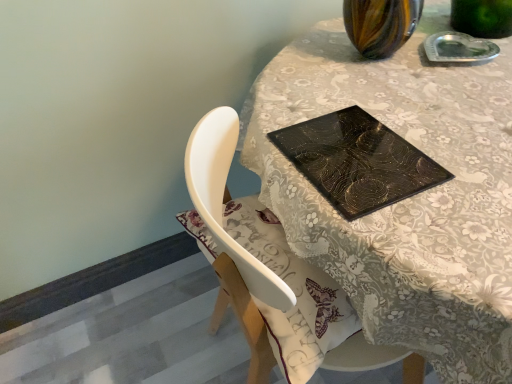
Find the location of a particular element. Image resolution: width=512 pixels, height=384 pixels. space that is in front of black glossy placemat at upper center is located at coordinates (389, 224).